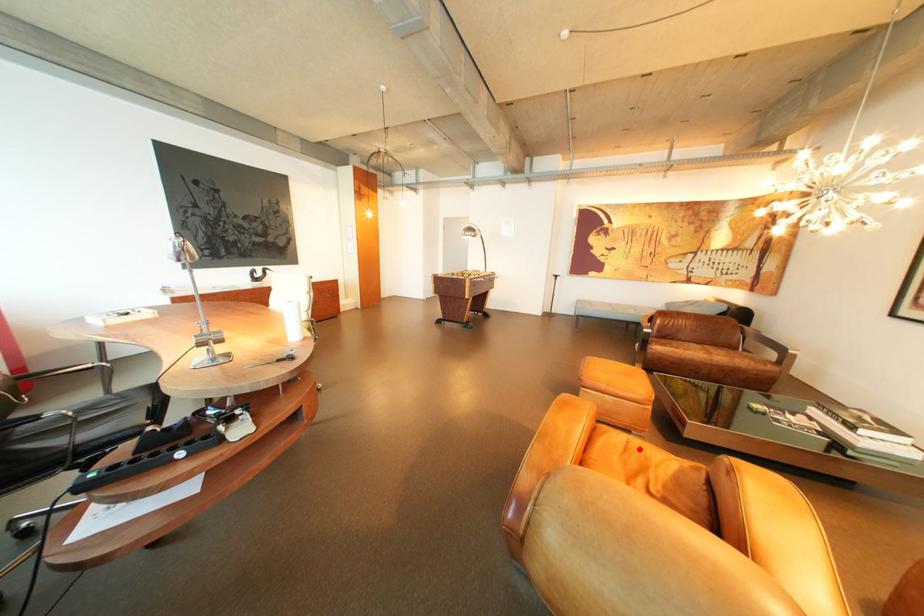
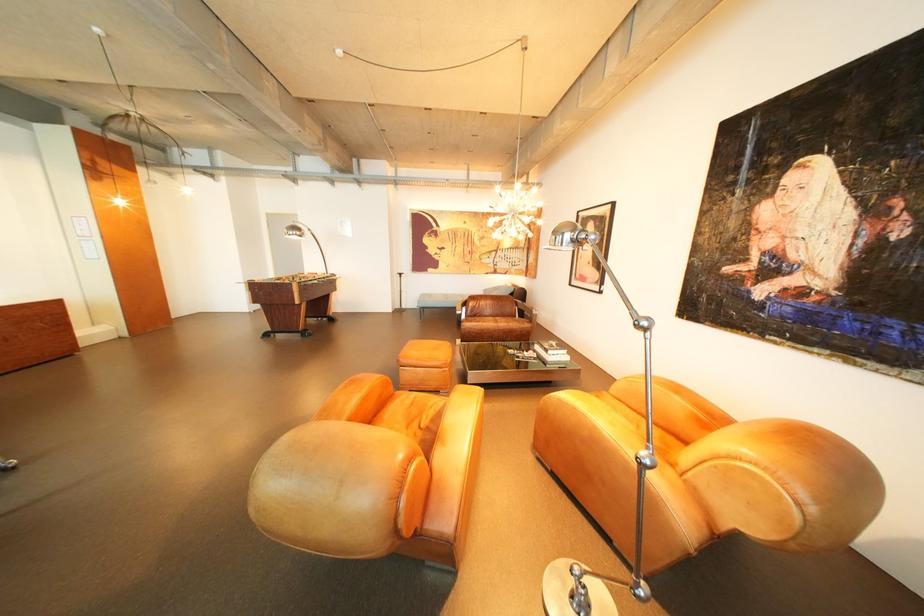
Where in the second image is the point corresponding to the highlighted location from the first image?

(426, 403)